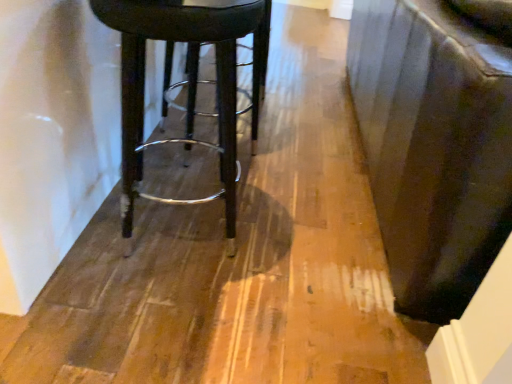
The height and width of the screenshot is (384, 512). Identify the location of free space in front of matte black stool at center. (148, 317).